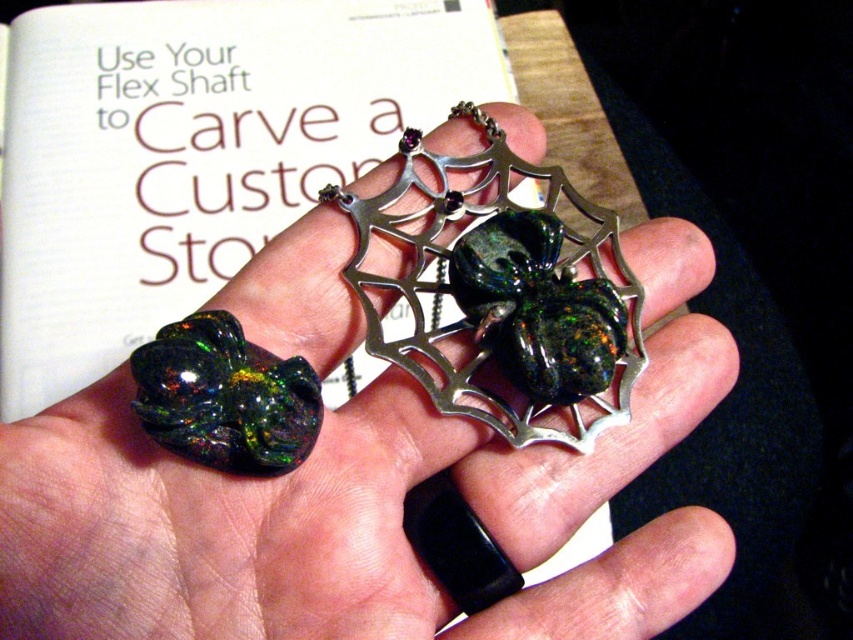
Can you confirm if white paper book at upper center is bigger than green opal spider at center?

Correct, white paper book at upper center is larger in size than green opal spider at center.

Between white paper book at upper center and green opal spider at center, which one is positioned lower?

green opal spider at center

The image size is (853, 640). I want to click on white paper book at upper center, so click(x=194, y=152).

Which is more to the right, green opal ring at center or opalescent stone insect at center?

Positioned to the right is green opal ring at center.

Can you confirm if green opal ring at center is shorter than opalescent stone insect at center?

No, green opal ring at center is not shorter than opalescent stone insect at center.

Identify the location of green opal ring at center. (347, 520).

In the scene shown: Who is lower down, green opal spider at center or opalescent stone insect at center?

opalescent stone insect at center

Is green opal spider at center thinner than opalescent stone insect at center?

Incorrect, green opal spider at center's width is not less than opalescent stone insect at center's.

Describe the element at coordinates (537, 308) in the screenshot. I see `green opal spider at center` at that location.

I want to click on green opal spider at center, so click(537, 308).